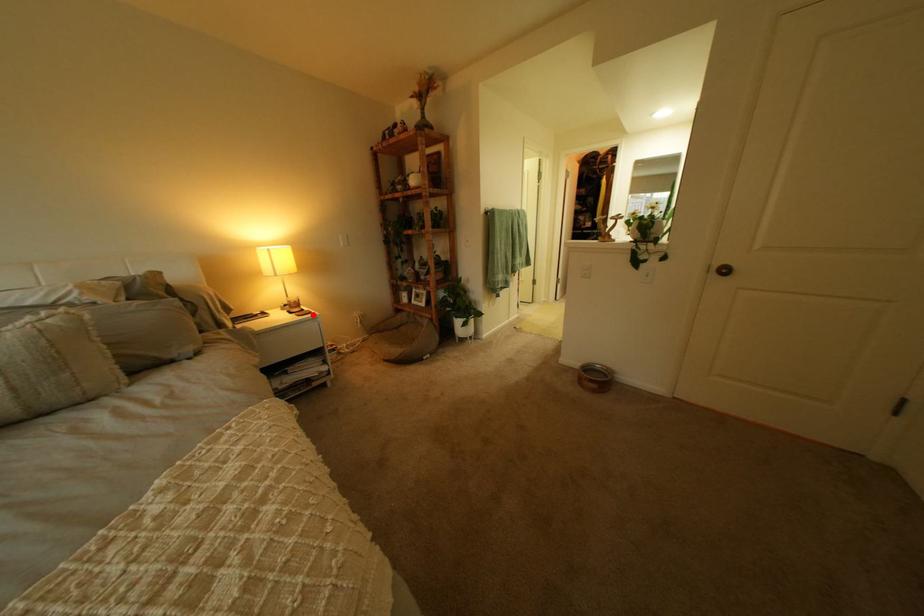
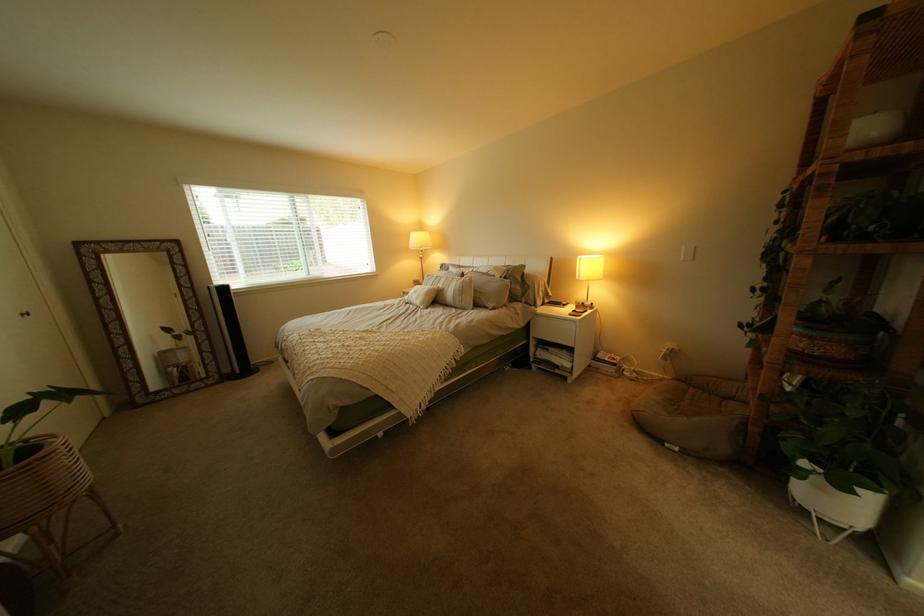
In the second image, find the point that corresponds to the highlighted location in the first image.

(590, 314)